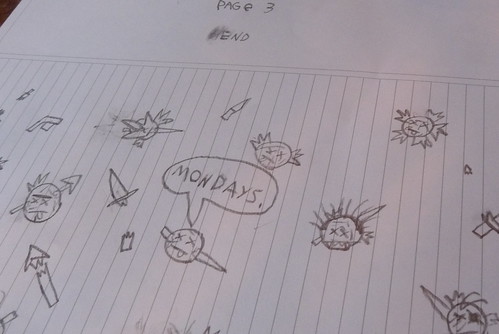
Locate an element on the screen. Image resolution: width=499 pixels, height=334 pixels. table is located at coordinates (7, 8).